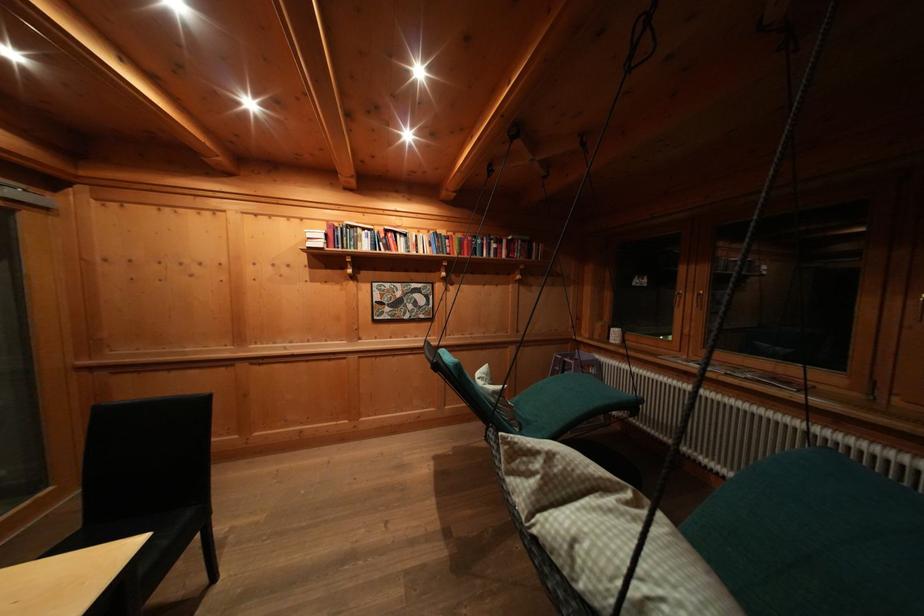
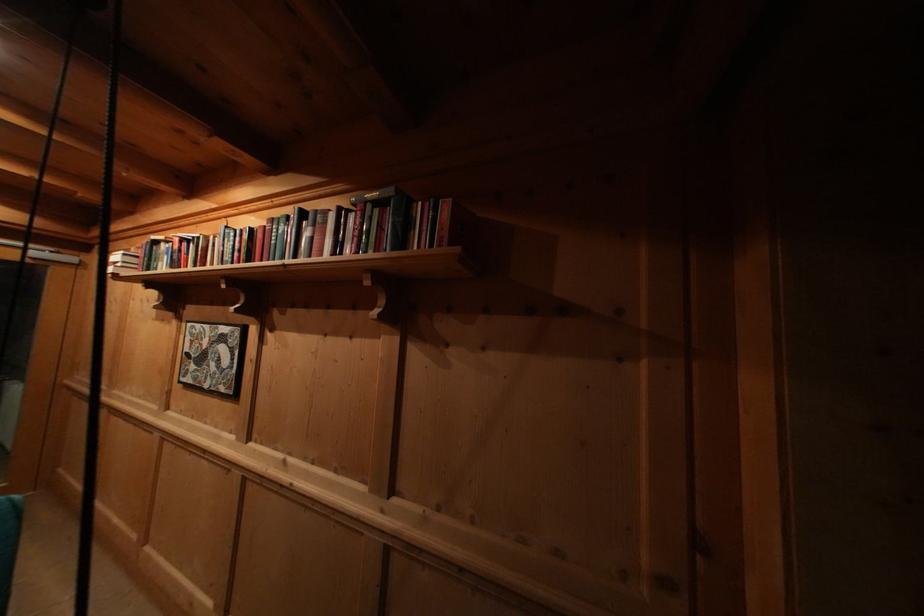
Where in the second image is the point corresponding to the point at 526,246 from the first image?

(375, 211)